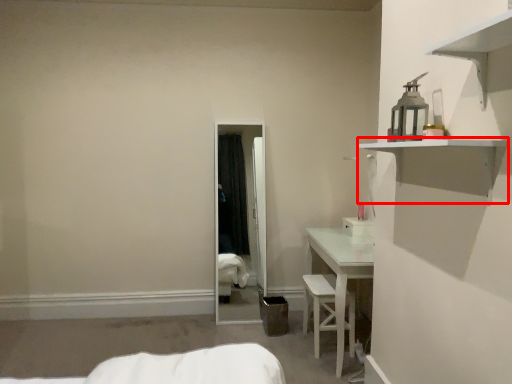
Question: Where is shelf (annotated by the red box) located in relation to armchair in the image?

Choices:
 (A) left
 (B) right

Answer: (B)